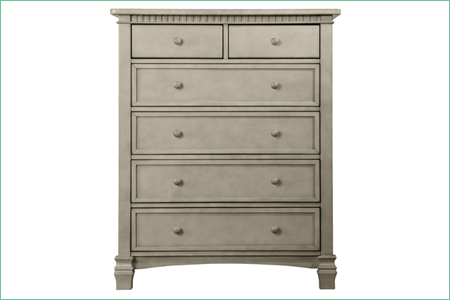
The height and width of the screenshot is (300, 450). Find the location of `you can put your clothes in here`. you can put your clothes in here is located at coordinates (232, 86), (228, 140), (227, 183), (225, 233).